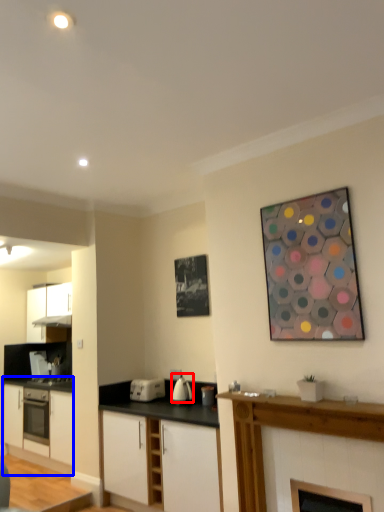
Question: Which point is closer to the camera, kitchen appliance (highlighted by a red box) or cabinetry (highlighted by a blue box)?

Choices:
 (A) kitchen appliance
 (B) cabinetry

Answer: (A)